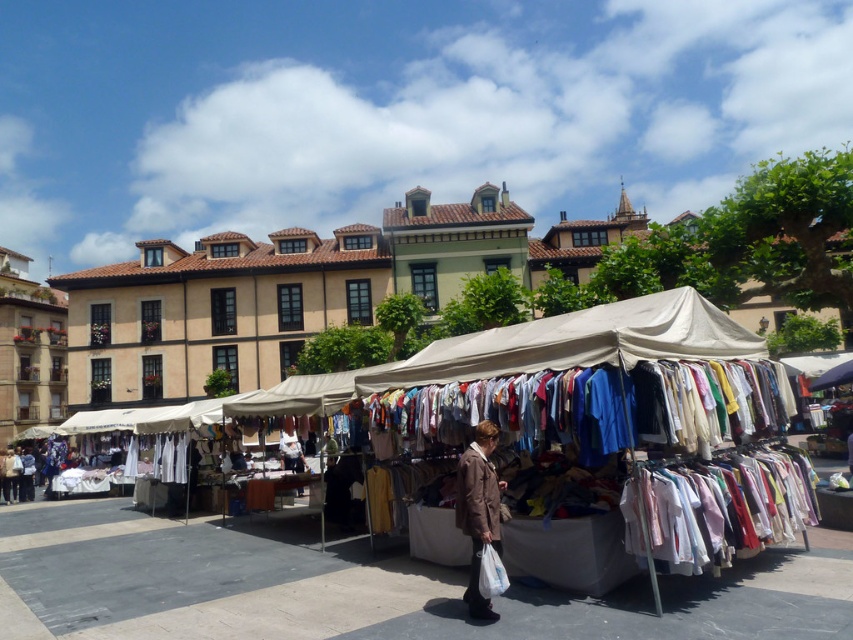
Which is more to the left, white fabric tent at center or white cotton shirt at center?

white cotton shirt at center

This screenshot has width=853, height=640. Describe the element at coordinates (196, 572) in the screenshot. I see `white fabric tent at center` at that location.

Which is behind, point (30, 605) or point (22, 452)?

Point (22, 452)

You are a GUI agent. You are given a task and a screenshot of the screen. Output one action in this format:
    pyautogui.click(x=<x>, y=<y>)
    Task: Click on the white fabric tent at center
    Image resolution: width=853 pixels, height=640 pixels.
    Given the screenshot: What is the action you would take?
    pyautogui.click(x=196, y=572)

Who is lower down, white fabric tent at center or brown fabric coat at lower center?

white fabric tent at center is below.

Between white fabric tent at center and brown fabric coat at lower center, which one appears on the right side from the viewer's perspective?

brown fabric coat at lower center is more to the right.

Which is in front, point (207, 448) or point (474, 595)?

Point (474, 595) is in front.

At what (x,y) coordinates should I click in order to perform the action: click on white fabric tent at center. Please return your answer as a coordinate pair (x, y). The image size is (853, 640). Looking at the image, I should click on (196, 572).

Based on the photo, who is more forward, [457,518] or [25,449]?

Positioned in front is point [457,518].

Looking at this image, is brown fabric coat at lower center above white cotton shirt at center?

Yes.

Does point (486, 477) lie in front of point (22, 484)?

Yes, point (486, 477) is closer to viewer.

Locate an element on the screen. brown fabric coat at lower center is located at coordinates (479, 512).